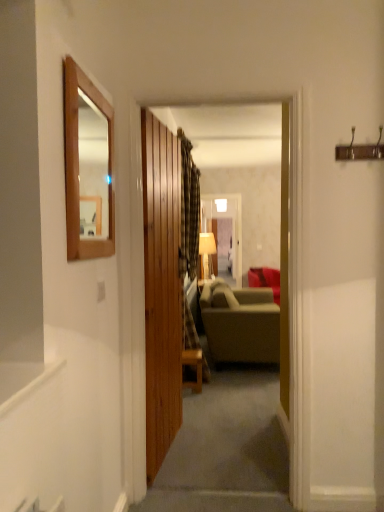
Identify the location of vacant space to the right of wooden door at center. This screenshot has width=384, height=512. (211, 444).